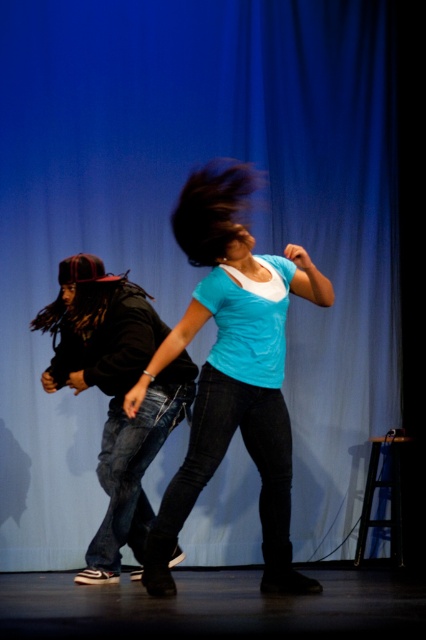
Does matte blue t-shirt at center have a smaller size compared to denim jeans at left?

Actually, matte blue t-shirt at center might be larger than denim jeans at left.

Does matte blue t-shirt at center have a lesser height compared to denim jeans at left?

Incorrect, matte blue t-shirt at center's height does not fall short of denim jeans at left's.

Identify the location of matte blue t-shirt at center. The width and height of the screenshot is (426, 640). (233, 369).